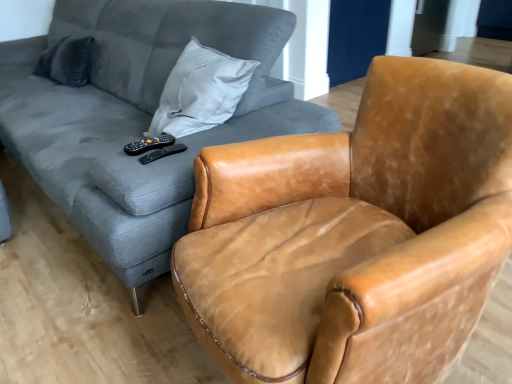
Question: Looking at the image, does leather armchair at center seem bigger or smaller compared to black matte remote at center, the 2th remote when ordered from left to right?

Choices:
 (A) small
 (B) big

Answer: (B)

Question: Would you say leather armchair at center is inside or outside black matte remote at center, the 2th remote when ordered from left to right?

Choices:
 (A) outside
 (B) inside

Answer: (A)

Question: Which is farther from the black plastic remote at center, which is the second remote from right to left?

Choices:
 (A) leather armchair at center
 (B) black matte remote at center, the 2th remote when ordered from left to right
 (C) matte gray fabric couch at upper left
 (D) dark gray fabric pillow at upper left

Answer: (D)

Question: Estimate the real-world distances between objects in this image. Which object is closer to the black matte remote at center, the 2th remote when ordered from left to right?

Choices:
 (A) dark gray fabric pillow at upper left
 (B) matte gray fabric couch at upper left
 (C) leather armchair at center
 (D) black plastic remote at center, marked as the 1th remote in a left-to-right arrangement

Answer: (D)